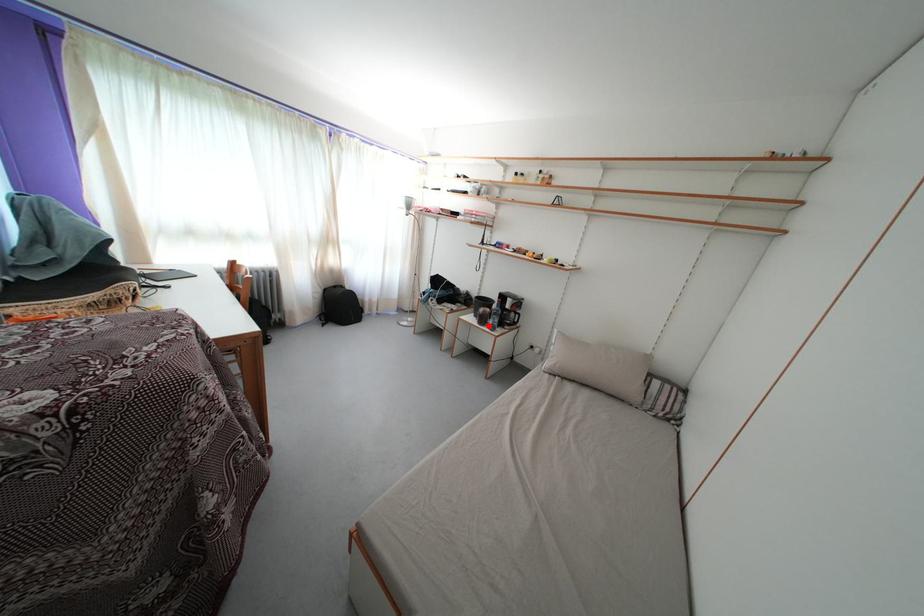
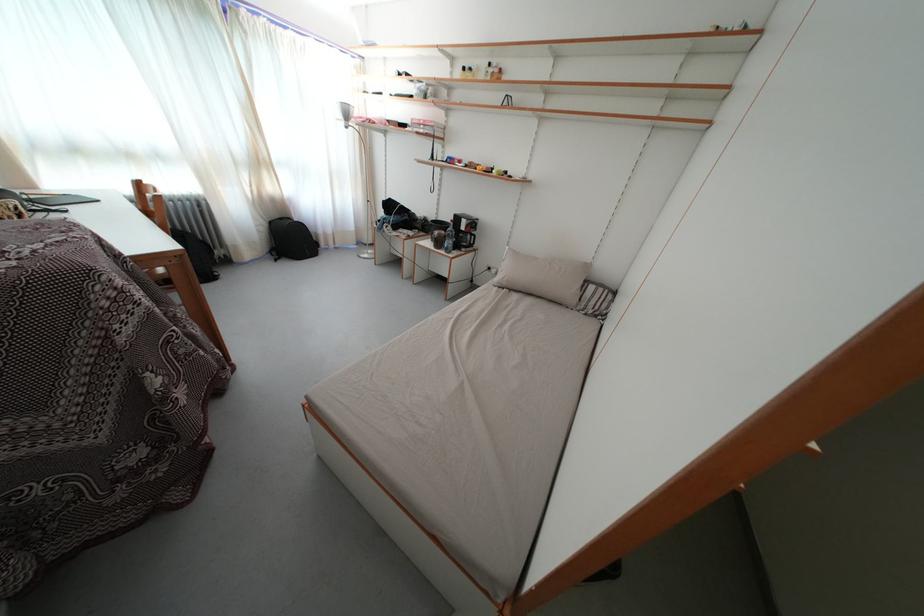
Question: I am providing you with two images of the same scene from different viewpoints. Given a red point in image1, look at the same physical point in image2. Is it:

Choices:
 (A) Closer to the viewpoint
 (B) Farther from the viewpoint

Answer: (A)